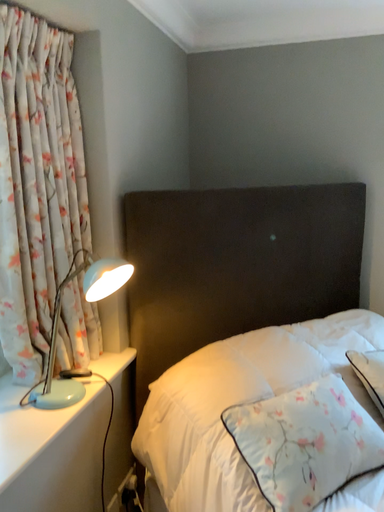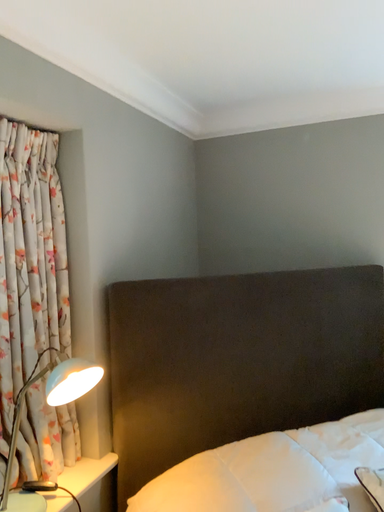
Question: Which way did the camera rotate in the video?

Choices:
 (A) rotated downward
 (B) rotated upward

Answer: (B)